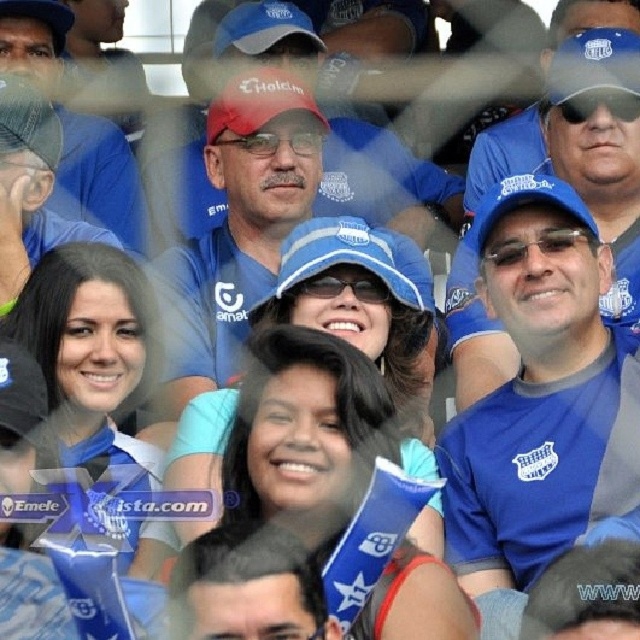
Question: Which object is closer to the camera taking this photo?

Choices:
 (A) matte blue cap at upper center
 (B) blue fabric shirt at center

Answer: (B)

Question: Which object is farther from the camera taking this photo?

Choices:
 (A) blue fabric cap at upper center
 (B) matte blue cap at upper center
 (C) blue fabric shirt at center

Answer: (B)

Question: Can you confirm if blue fabric shirt at center is positioned to the left of matte blue cap at upper center?

Choices:
 (A) yes
 (B) no

Answer: (B)

Question: Is blue fabric cap at upper center to the left of matte blue cap at upper center from the viewer's perspective?

Choices:
 (A) yes
 (B) no

Answer: (B)

Question: Is blue fabric shirt at center smaller than matte blue cap at upper center?

Choices:
 (A) yes
 (B) no

Answer: (B)

Question: Which object is the farthest from the blue fabric shirt at center?

Choices:
 (A) matte blue cap at upper center
 (B) blue fabric cap at upper center

Answer: (A)